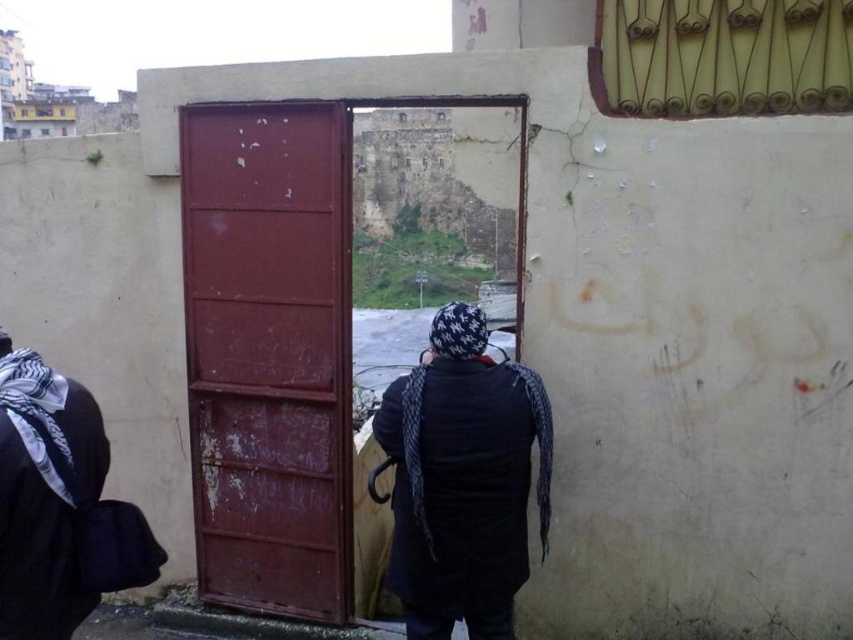
How much distance is there between rusty metal door at center and black knit cap at center?

The distance of rusty metal door at center from black knit cap at center is 3.29 feet.

Which is below, rusty metal door at center or black knit cap at center?

Positioned lower is black knit cap at center.

Which is in front, point (212, 401) or point (408, 632)?

Point (408, 632) is more forward.

Locate an element on the screen. The height and width of the screenshot is (640, 853). rusty metal door at center is located at coordinates (270, 353).